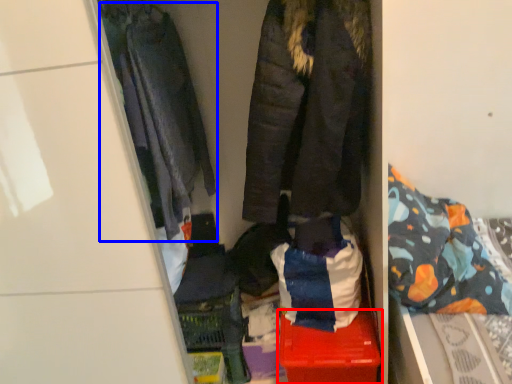
Question: Which point is closer to the camera, storage box (highlighted by a red box) or jacket (highlighted by a blue box)?

Choices:
 (A) storage box
 (B) jacket

Answer: (B)